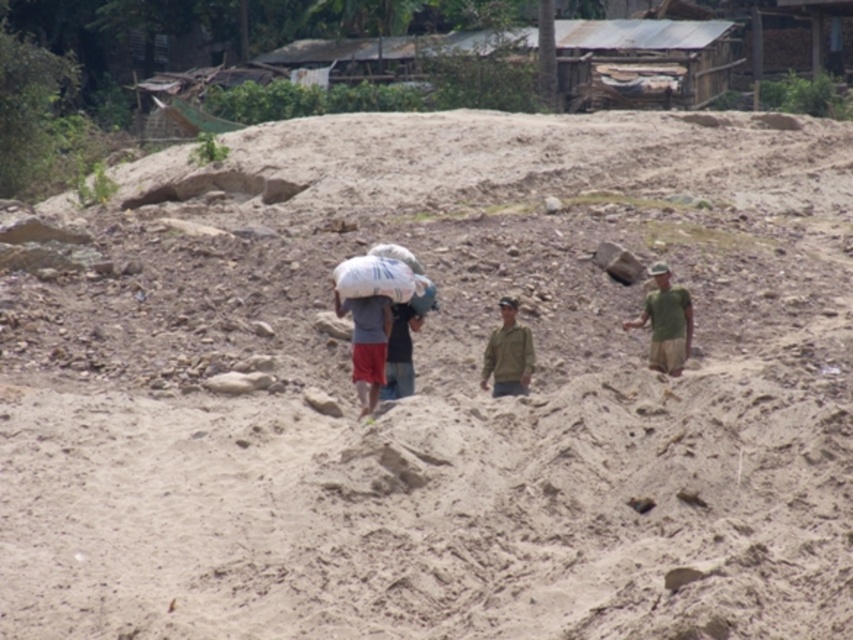
Between green matte jacket at center and green fabric cap at center, which one has less height?

Standing shorter between the two is green fabric cap at center.

Which is in front, point (515, 392) or point (514, 314)?

Point (515, 392) is in front.

Is point (492, 332) more distant than point (502, 307)?

Yes, point (492, 332) is farther from viewer.

Find the location of `green matte jacket at center`. green matte jacket at center is located at coordinates (508, 353).

Locate an element on the screen. green fabric shirt at right is located at coordinates (666, 321).

Can you confirm if green fabric shirt at right is positioned to the right of green matte hat at center?

In fact, green fabric shirt at right is to the left of green matte hat at center.

Locate an element on the screen. This screenshot has width=853, height=640. green fabric shirt at right is located at coordinates (666, 321).

Find the location of a particular element. green fabric shirt at right is located at coordinates (666, 321).

Can you confirm if green matte hat at center is taller than green fabric cap at center?

In fact, green matte hat at center may be shorter than green fabric cap at center.

Which is more to the left, green matte hat at center or green fabric cap at center?

green fabric cap at center is more to the left.

Where is `green matte hat at center`? This screenshot has width=853, height=640. green matte hat at center is located at coordinates (659, 275).